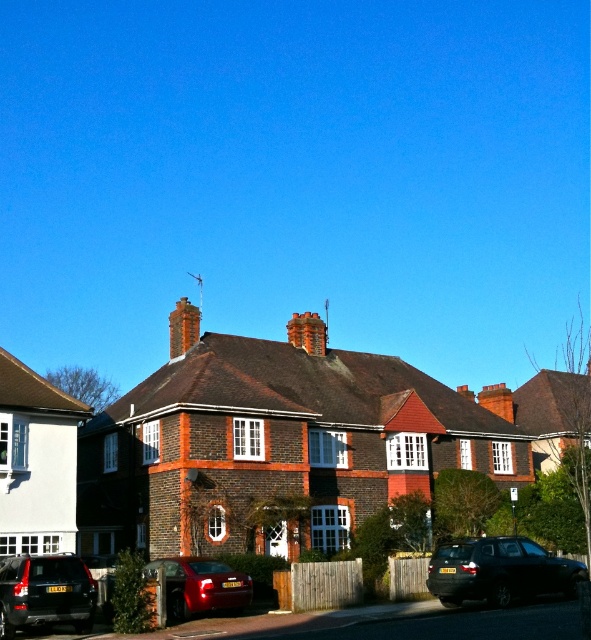
You are standing on the sidewalk in front of the house and want to take a photo of the brick chimney at center. However, there is a matte black suv at lower left blocking your view. Can you move to the right to get a clear shot without the suv obstructing the chimney?

The matte black suv at lower left is closer to the viewer than the brick chimney at center, so moving to the right might allow you to position yourself around the suv to see the chimney. However, since the suv is in front, you would need to move far enough to the right to ensure the suv no longer blocks the chimney in your line of sight.

You are standing on the sidewalk in front of the house and want to take a photo of the brick chimney at center. However, there is a metallic red car at lower center blocking your view. Can you move to the side to get a clear shot of the chimney without the car in the way?

The metallic red car at lower center is closer to the viewer than the brick chimney at center, so moving to the side might allow you to position yourself around the car to see the chimney. However, since the car is between you and the chimney, you would need to move to either the left or right side of the car to get a clear view of the brick chimney at center.

You are a delivery person trying to park your van, which is 2 meters wide, in the space between the metallic red car at lower center and the brick chimney at center. Based on the scene, can your van fit there?

The metallic red car at lower center has a lesser width compared to brick chimney at center. Since the van is 2 meters wide, and the space between them is wider than the van, the van can fit there.